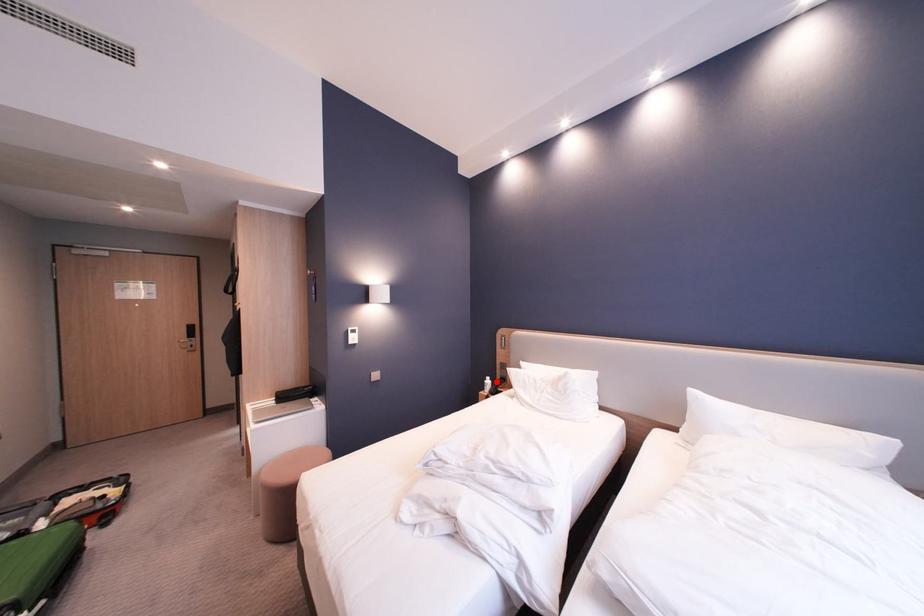
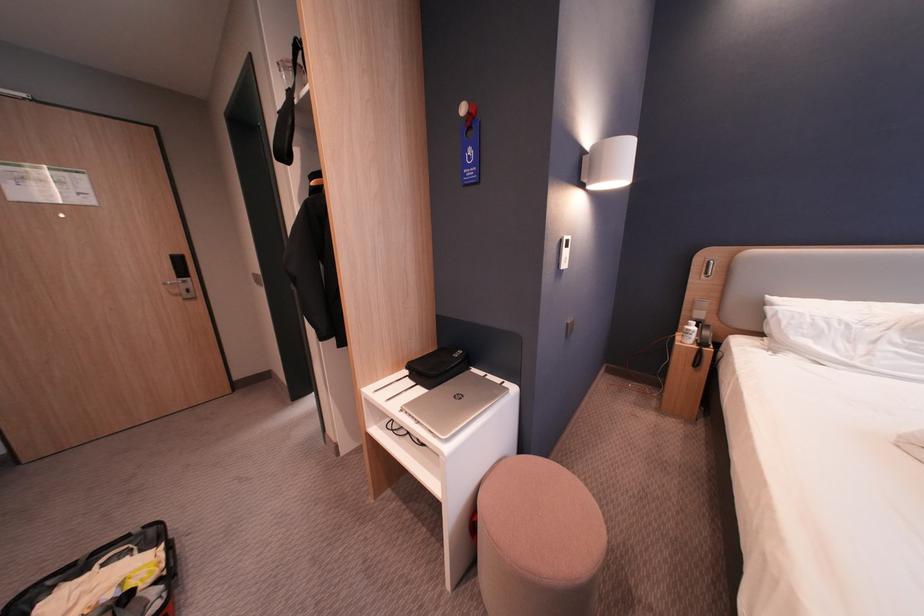
Find the pixel in the second image that matches the highlighted location in the first image.

(698, 328)